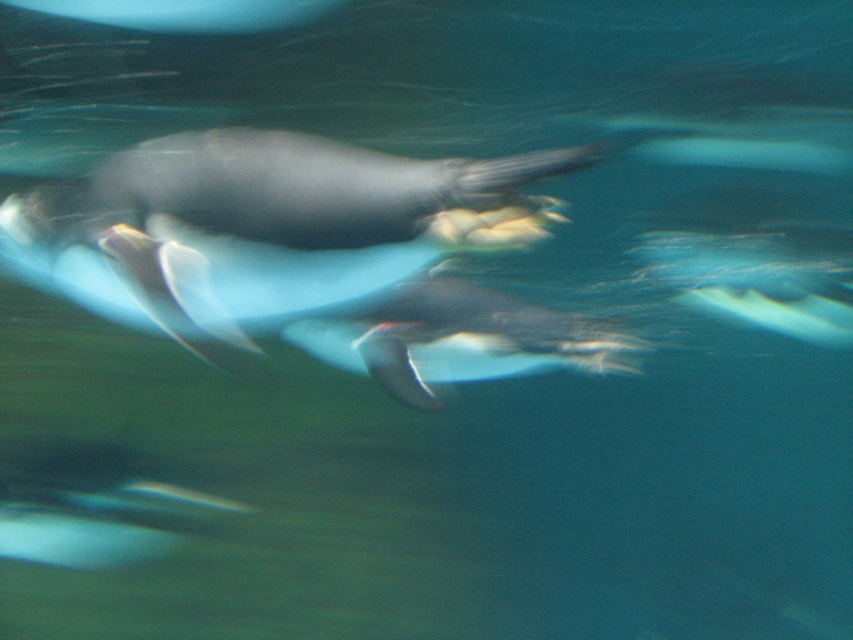
Question: Among these points, which one is nearest to the camera?

Choices:
 (A) (74, 538)
 (B) (61, 240)

Answer: (B)

Question: Can you confirm if white glossy penguin at center is positioned to the left of black matte penguin at lower left?

Choices:
 (A) no
 (B) yes

Answer: (A)

Question: Which object is positioned closest to the white glossy penguin at center?

Choices:
 (A) white matte penguin at center
 (B) black matte penguin at lower left

Answer: (A)

Question: Is white matte penguin at center to the right of black matte penguin at lower left from the viewer's perspective?

Choices:
 (A) no
 (B) yes

Answer: (B)

Question: Is white glossy penguin at center wider than white matte penguin at center?

Choices:
 (A) yes
 (B) no

Answer: (A)

Question: Among these points, which one is nearest to the camera?

Choices:
 (A) (134, 300)
 (B) (28, 516)
 (C) (410, 384)

Answer: (A)